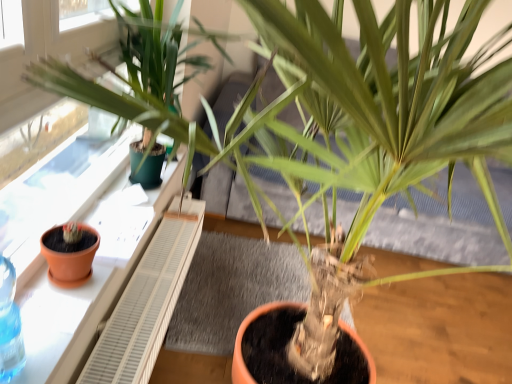
Question: Can you confirm if terracotta clay pot at left is taller than terracotta clay pot at left?

Choices:
 (A) no
 (B) yes

Answer: (A)

Question: Is terracotta clay pot at left facing towards terracotta clay pot at left?

Choices:
 (A) yes
 (B) no

Answer: (B)

Question: Does terracotta clay pot at left touch terracotta clay pot at left?

Choices:
 (A) no
 (B) yes

Answer: (A)

Question: Does terracotta clay pot at left have a lesser height compared to terracotta clay pot at left?

Choices:
 (A) no
 (B) yes

Answer: (B)

Question: Is terracotta clay pot at left at the left side of terracotta clay pot at left?

Choices:
 (A) no
 (B) yes

Answer: (B)

Question: Is terracotta clay pot at left closer to camera compared to terracotta clay pot at left?

Choices:
 (A) yes
 (B) no

Answer: (A)

Question: Is terracotta clay pot at left facing towards terracotta clay pot at left?

Choices:
 (A) yes
 (B) no

Answer: (B)

Question: Is terracotta clay pot at left positioned beyond the bounds of terracotta clay pot at left?

Choices:
 (A) yes
 (B) no

Answer: (A)

Question: From the image's perspective, would you say terracotta clay pot at left is positioned over terracotta clay pot at left?

Choices:
 (A) yes
 (B) no

Answer: (B)

Question: Is terracotta clay pot at left located within terracotta clay pot at left?

Choices:
 (A) no
 (B) yes

Answer: (A)

Question: Can you confirm if terracotta clay pot at left is bigger than terracotta clay pot at left?

Choices:
 (A) no
 (B) yes

Answer: (A)

Question: Is terracotta clay pot at left in contact with terracotta clay pot at left?

Choices:
 (A) yes
 (B) no

Answer: (B)

Question: Considering the positions of point (27, 296) and point (68, 276), is point (27, 296) closer or farther from the camera than point (68, 276)?

Choices:
 (A) closer
 (B) farther

Answer: (A)